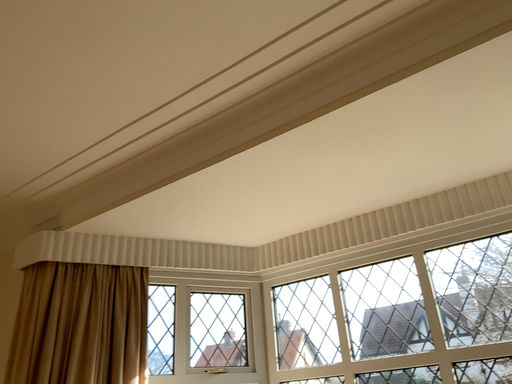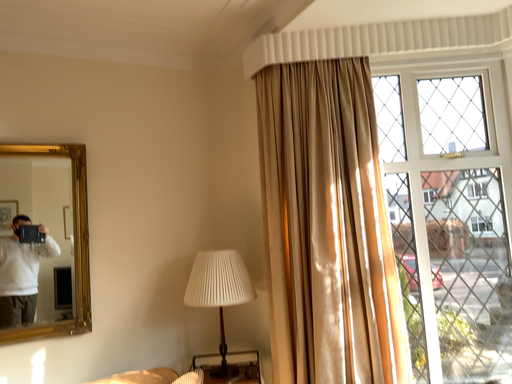
Question: Which way did the camera rotate in the video?

Choices:
 (A) rotated downward
 (B) rotated upward

Answer: (A)